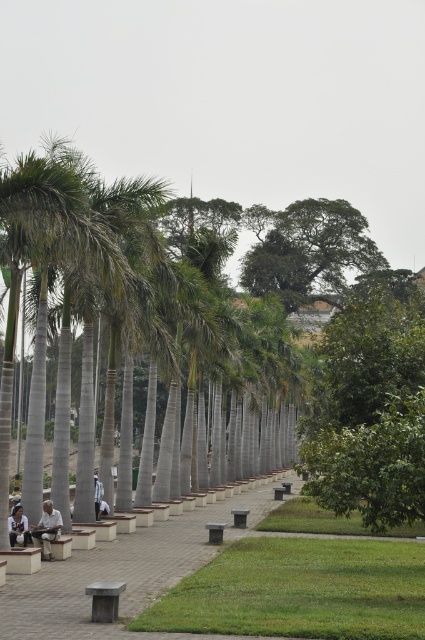
This screenshot has height=640, width=425. Describe the element at coordinates (121, 573) in the screenshot. I see `gray concrete bench at center` at that location.

Describe the element at coordinates (121, 573) in the screenshot. I see `gray concrete bench at center` at that location.

I want to click on gray concrete bench at center, so click(x=121, y=573).

Can you confirm if gray concrete bench at center is positioned to the left of green leafy tree at upper center?

Yes, gray concrete bench at center is to the left of green leafy tree at upper center.

Who is lower down, gray concrete bench at center or green leafy tree at upper center?

Positioned lower is gray concrete bench at center.

Who is more forward, (119, 540) or (311, 268)?

Positioned in front is point (119, 540).

Locate an element on the screen. This screenshot has width=425, height=640. gray concrete bench at center is located at coordinates tap(121, 573).

Measure the distance between point (206, 509) and camera.

A distance of 47.84 meters exists between point (206, 509) and camera.

Is gray concrete bench at center further to camera compared to smooth gray bench at lower center?

No, it is in front of smooth gray bench at lower center.

Which is in front, point (116, 573) or point (101, 618)?

Point (101, 618)

Identify the location of gray concrete bench at center. (121, 573).